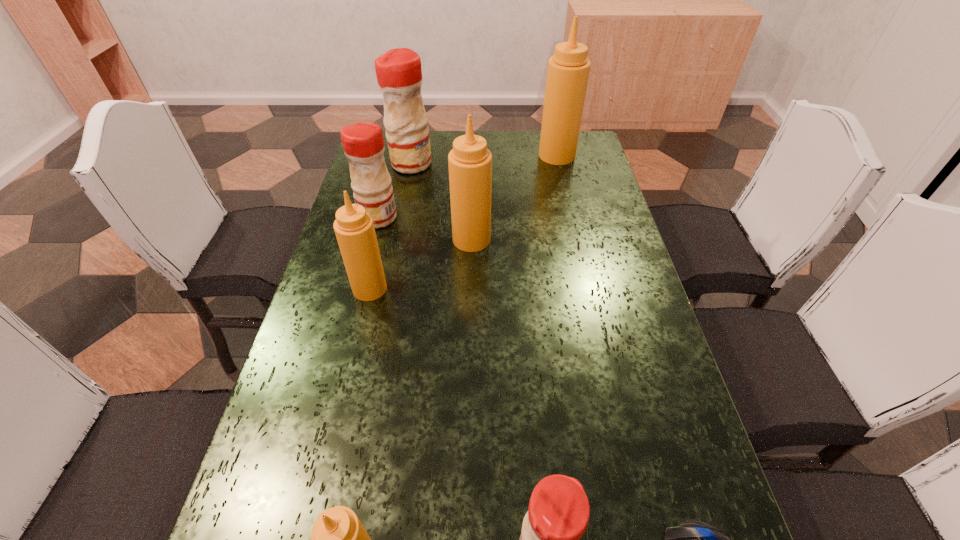
The image size is (960, 540). What are the coordinates of `free point between the second smallest red condiment and the farthest red condiment` in the screenshot? It's located at [395, 191].

Find the location of a particular element. The height and width of the screenshot is (540, 960). vacant area between the fifth condiment from left to right and the farthest red condiment is located at coordinates (442, 202).

In order to click on object that is the fifth closest one to the farthest tan condiment in this screenshot , I will do `click(558, 514)`.

Locate which object ranks sixth in proximity to the farthest tan condiment. Please provide its 2D coordinates. Your answer should be formatted as a tuple, i.e. [(x, y)], where the tuple contains the x and y coordinates of a point satisfying the conditions above.

[(692, 539)]

Choose which condiment is the fourth nearest neighbor to the second tan condiment from left to right. Please provide its 2D coordinates. Your answer should be formatted as a tuple, i.e. [(x, y)], where the tuple contains the x and y coordinates of a point satisfying the conditions above.

[(363, 144)]

Locate an element on the screen. Image resolution: width=960 pixels, height=540 pixels. condiment identified as the closest to the nearest tan condiment is located at coordinates (558, 514).

Image resolution: width=960 pixels, height=540 pixels. I want to click on tan condiment that is the second closest to the rightmost condiment, so click(x=354, y=228).

Locate an element on the screen. The height and width of the screenshot is (540, 960). tan condiment that can be found as the closest to the biggest red condiment is located at coordinates (470, 162).

Find the location of a particular element. The width and height of the screenshot is (960, 540). red condiment that is the closest to the farthest red condiment is located at coordinates (363, 144).

Image resolution: width=960 pixels, height=540 pixels. What are the coordinates of `red condiment that stands as the second closest to the smallest tan condiment` in the screenshot? It's located at (363, 144).